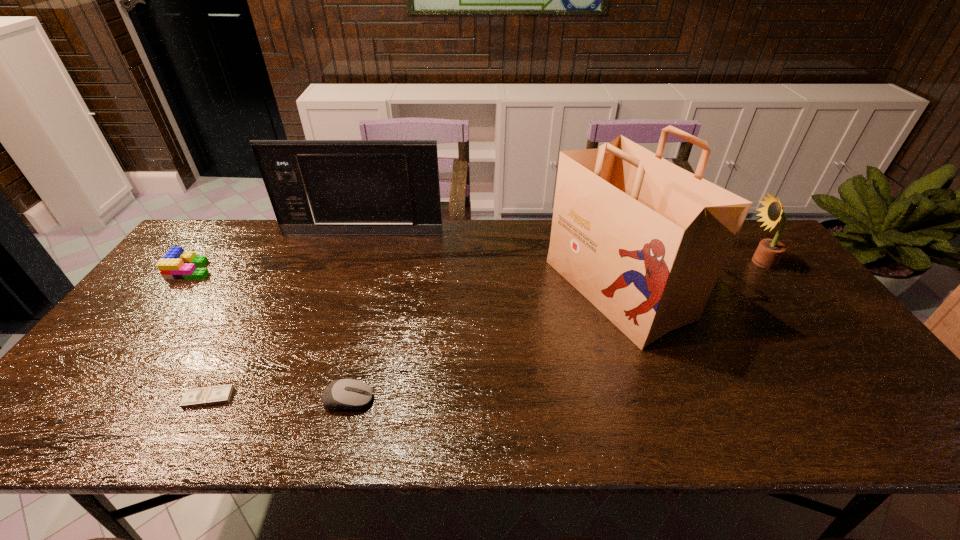
Locate an element on the screen. The image size is (960, 540). the fifth object from left to right is located at coordinates click(x=644, y=240).

The image size is (960, 540). What are the coordinates of `grocery bag` in the screenshot? It's located at (644, 240).

Locate an element on the screen. The height and width of the screenshot is (540, 960). microwave oven is located at coordinates (316, 187).

Find the location of `the fifth shortest object`. the fifth shortest object is located at coordinates (316, 187).

At what (x,y) coordinates should I click in order to perform the action: click on the fourth shortest object. Please return your answer as a coordinate pair (x, y). Image resolution: width=960 pixels, height=540 pixels. Looking at the image, I should click on (769, 252).

Identify the location of sunflower. The width and height of the screenshot is (960, 540). (769, 252).

Where is `Lego`? The width and height of the screenshot is (960, 540). Lego is located at coordinates pyautogui.click(x=176, y=264).

Where is `the fourth tallest object`? The height and width of the screenshot is (540, 960). the fourth tallest object is located at coordinates (176, 264).

Find the location of `the fifth tallest object`. the fifth tallest object is located at coordinates (344, 394).

At what (x,y) coordinates should I click in order to perform the action: click on the shortest object. Please return your answer as a coordinate pair (x, y). Looking at the image, I should click on (214, 395).